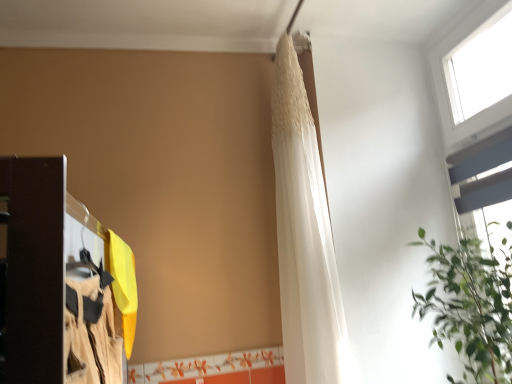
Question: Considering the relative sizes of white plastic window at upper right and white sheer fabric at upper center in the image provided, is white plastic window at upper right shorter than white sheer fabric at upper center?

Choices:
 (A) no
 (B) yes

Answer: (B)

Question: Can you confirm if white plastic window at upper right is positioned to the right of white sheer fabric at upper center?

Choices:
 (A) no
 (B) yes

Answer: (B)

Question: From a real-world perspective, is white plastic window at upper right physically above white sheer fabric at upper center?

Choices:
 (A) no
 (B) yes

Answer: (B)

Question: From the image's perspective, is white plastic window at upper right on top of white sheer fabric at upper center?

Choices:
 (A) yes
 (B) no

Answer: (A)

Question: Is white plastic window at upper right in contact with white sheer fabric at upper center?

Choices:
 (A) no
 (B) yes

Answer: (A)

Question: Considering the positions of white plastic window at upper right and white sheer fabric at upper center in the image, is white plastic window at upper right taller or shorter than white sheer fabric at upper center?

Choices:
 (A) tall
 (B) short

Answer: (B)

Question: In the image, is white plastic window at upper right on the left side or the right side of white sheer fabric at upper center?

Choices:
 (A) left
 (B) right

Answer: (B)

Question: Would you say white plastic window at upper right is inside or outside white sheer fabric at upper center?

Choices:
 (A) inside
 (B) outside

Answer: (B)

Question: From a real-world perspective, is white plastic window at upper right physically located above or below white sheer fabric at upper center?

Choices:
 (A) below
 (B) above

Answer: (B)

Question: Relative to white plastic window at upper right, is white sheer fabric at upper center in front or behind?

Choices:
 (A) behind
 (B) front

Answer: (A)

Question: Is white sheer fabric at upper center taller or shorter than white plastic window at upper right?

Choices:
 (A) tall
 (B) short

Answer: (A)

Question: Considering the positions of white sheer fabric at upper center and white plastic window at upper right in the image, is white sheer fabric at upper center bigger or smaller than white plastic window at upper right?

Choices:
 (A) small
 (B) big

Answer: (B)

Question: Based on their positions, is white sheer fabric at upper center located to the left or right of white plastic window at upper right?

Choices:
 (A) left
 (B) right

Answer: (A)

Question: Would you say white sheer fabric at upper center is to the left or to the right of green leafy plant at upper right in the picture?

Choices:
 (A) right
 (B) left

Answer: (B)

Question: Considering the positions of point (307, 268) and point (496, 327), is point (307, 268) closer or farther from the camera than point (496, 327)?

Choices:
 (A) farther
 (B) closer

Answer: (A)